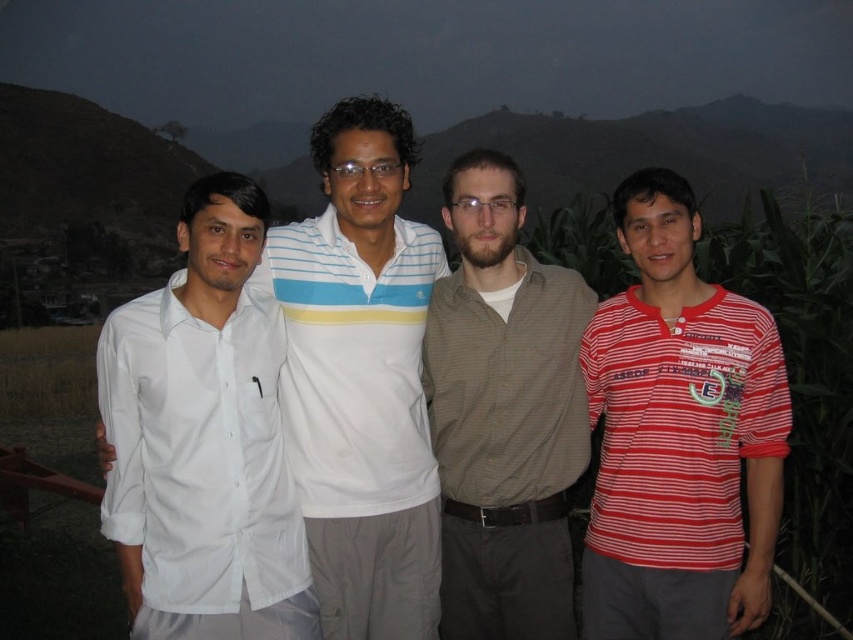
Question: Which point appears closest to the camera in this image?

Choices:
 (A) (743, 243)
 (B) (659, 307)
 (C) (465, 353)

Answer: (B)

Question: Does green leafy corn field at right appear on the left side of white cotton shirt at left?

Choices:
 (A) no
 (B) yes

Answer: (A)

Question: Which is nearer to the green leafy corn field at right?

Choices:
 (A) brown textured shirt at center
 (B) white striped polo shirt at center

Answer: (B)

Question: Which object is farther from the camera taking this photo?

Choices:
 (A) white cotton shirt at left
 (B) red striped shirt at right
 (C) white striped polo shirt at center
 (D) brown textured shirt at center

Answer: (C)

Question: Is brown textured shirt at center above white cotton shirt at left?

Choices:
 (A) yes
 (B) no

Answer: (A)

Question: Where is white cotton shirt at center located in relation to white cotton shirt at left in the image?

Choices:
 (A) right
 (B) left

Answer: (A)